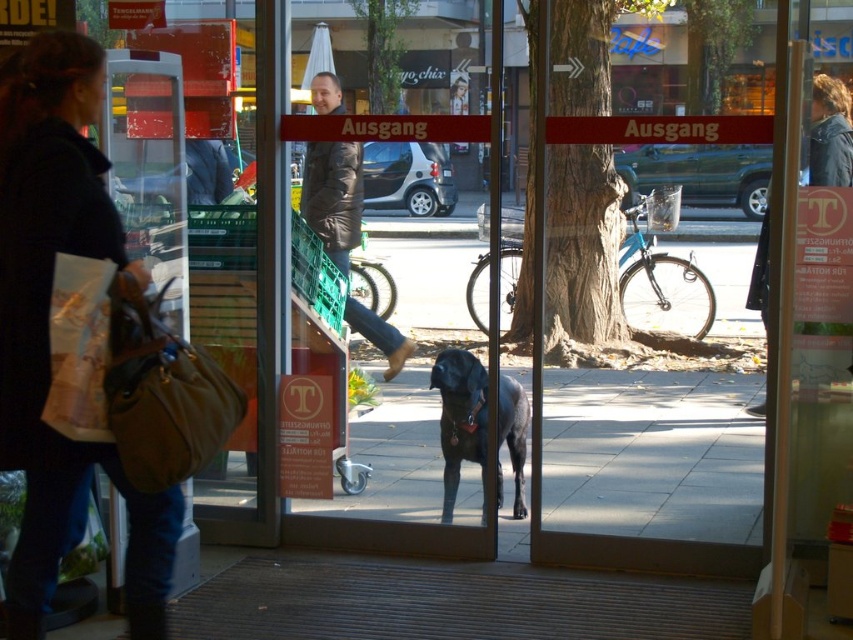
You are a customer entering the store and need to locate both the brown leather jacket at center and the shiny black dog at center. Which object is taller?

The brown leather jacket at center is much taller than the shiny black dog at center.

You are a delivery person trying to navigate through the entrance. The dark blue jeans at lower left and the shiny black dog at center are in your path. Which object is wider and might require more space to avoid?

The dark blue jeans at lower left is wider than the shiny black dog at center, so you should give more space to the dark blue jeans at lower left to avoid collision.

You are standing outside the store entrance and see both the brown leather jacket at center and the shiny black dog at center through the glass doors. Which object is closer to you?

The brown leather jacket at center is closer to you because it is further to the viewer than the shiny black dog at center.